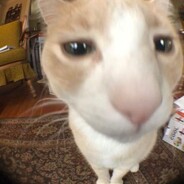
This screenshot has width=184, height=184. Find the location of `beige wall`. beige wall is located at coordinates (24, 7).